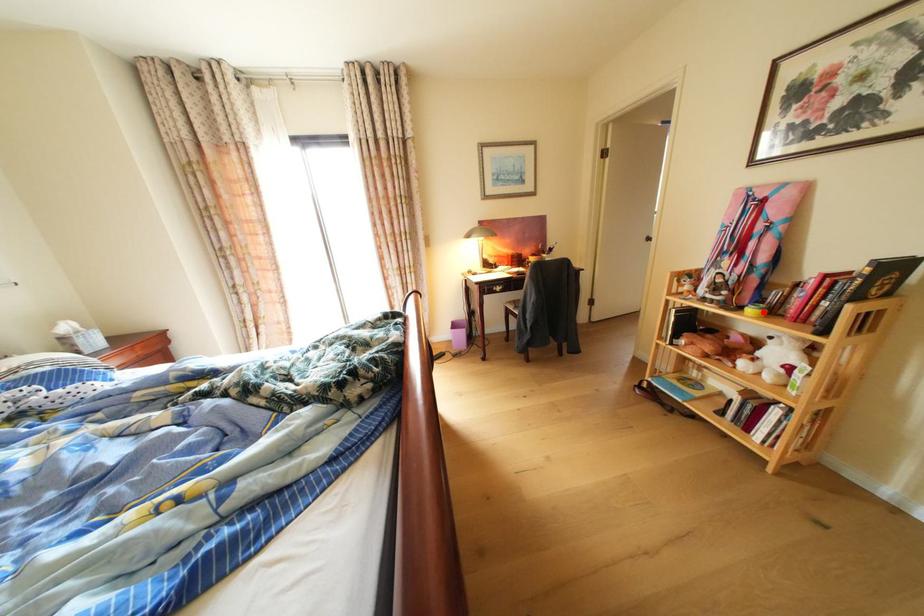
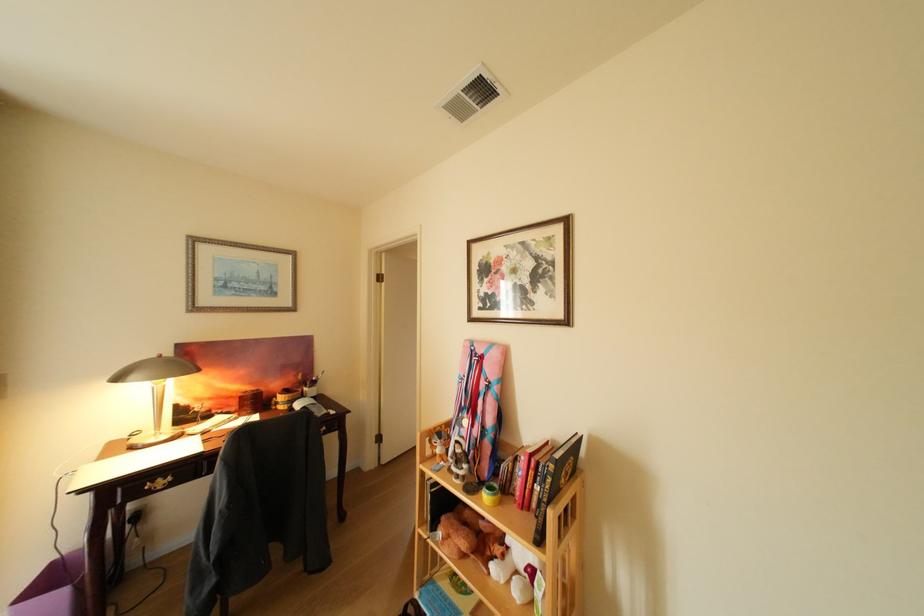
Question: I am providing you with two images of the same scene from different viewpoints. A red point is marked on the first image. Can you still see the location of the red point in image 2?

Choices:
 (A) Yes
 (B) No

Answer: (A)